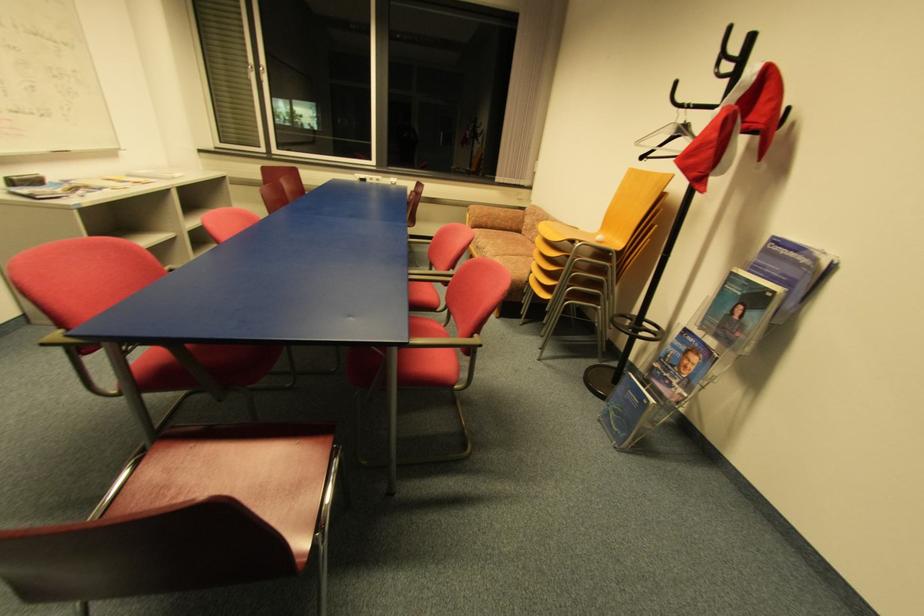
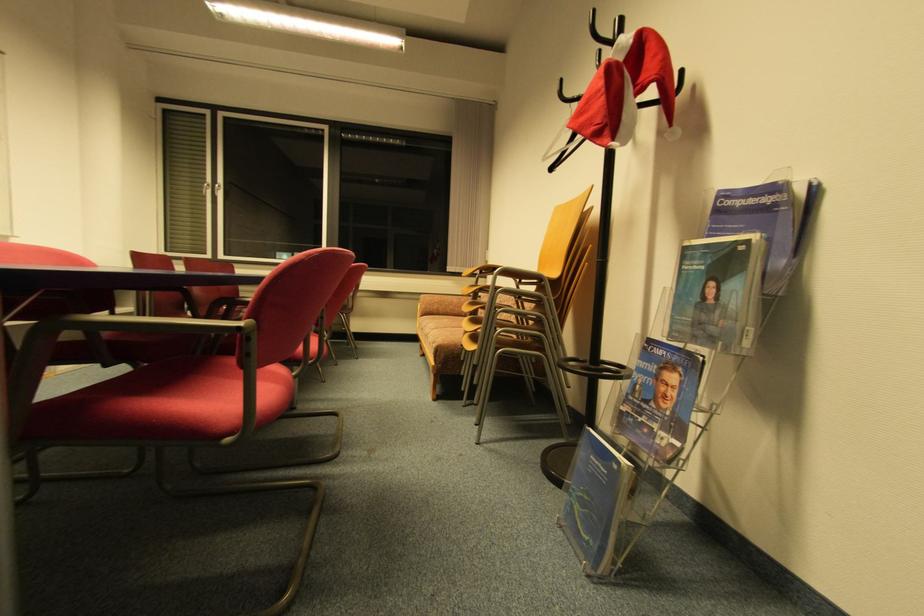
Which direction would the cameraman need to move to produce the second image?

The cameraman moved toward right, forward.